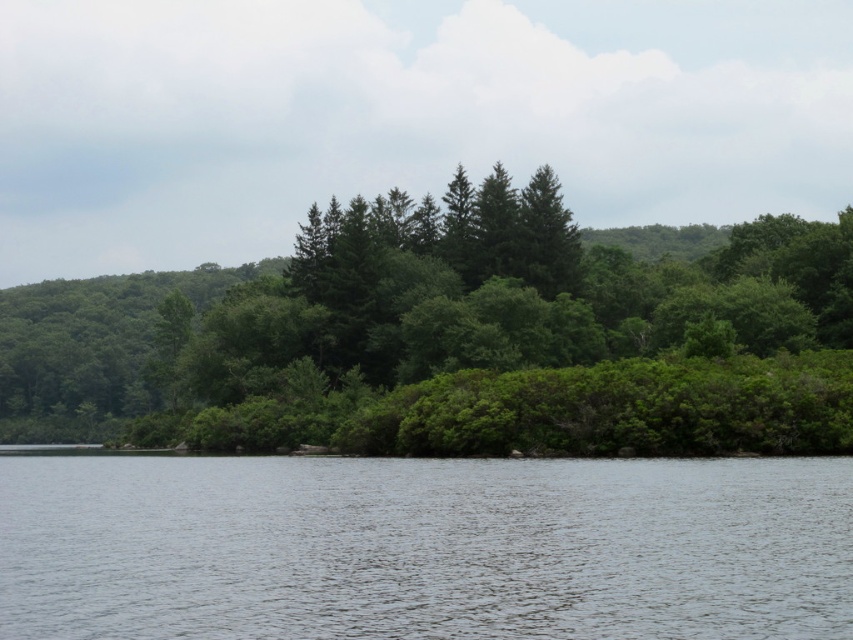
Can you confirm if green leafy trees at center is positioned to the right of clear water at center?

In fact, green leafy trees at center is to the left of clear water at center.

Measure the distance between point (311, 308) and camera.

Point (311, 308) is 122.00 meters away from camera.

What do you see at coordinates (461, 340) in the screenshot?
I see `green leafy trees at center` at bounding box center [461, 340].

At what (x,y) coordinates should I click in order to perform the action: click on green leafy trees at center. Please return your answer as a coordinate pair (x, y). Image resolution: width=853 pixels, height=640 pixels. Looking at the image, I should click on (461, 340).